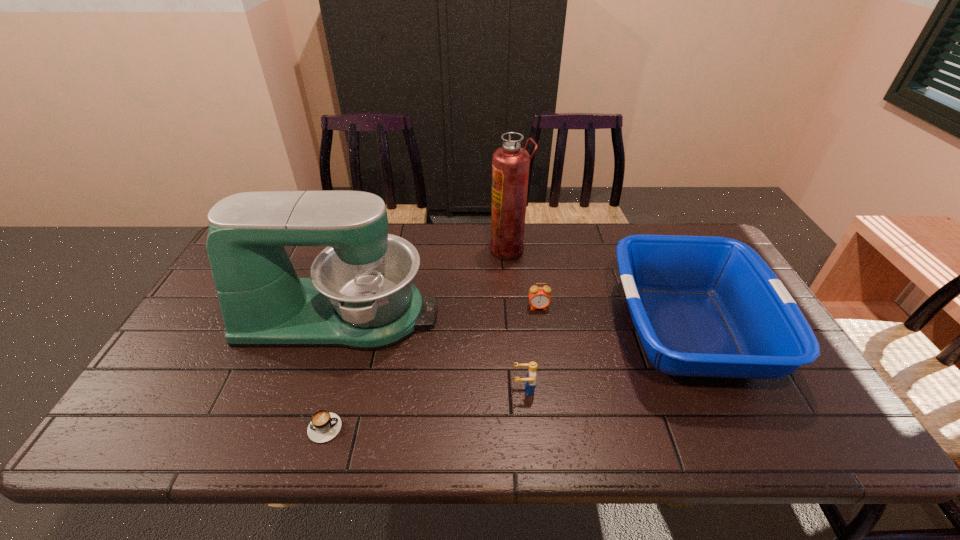
I want to click on free spot that satisfies the following two spatial constraints: 1. on the face of the alarm clock; 2. on the left side of the rightmost object, so click(x=541, y=330).

Identify the location of free space that satisfies the following two spatial constraints: 1. on the face of the alarm clock; 2. on the front-facing side of the mixer. The height and width of the screenshot is (540, 960). (540, 315).